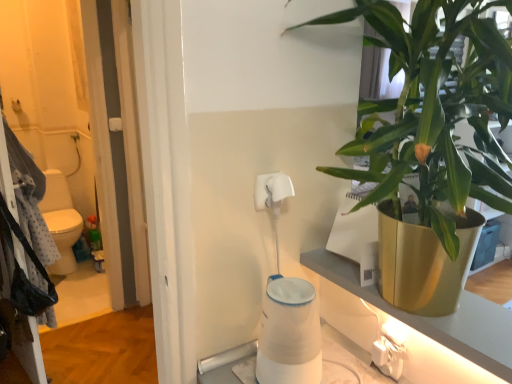
In order to face white plastic electric outlet at lower right, should I rotate leftwards or rightwards?

You should rotate right by 17.111 degrees.

This screenshot has height=384, width=512. Find the location of `white plastic electric outlet at lower right`. white plastic electric outlet at lower right is located at coordinates (390, 350).

Considering the relative positions of spotted fabric laundry at left and white matte toilet paper at upper center, which ranks as the 1th toilet paper in top-to-bottom order, in the image provided, is spotted fabric laundry at left to the left of white matte toilet paper at upper center, which ranks as the 1th toilet paper in top-to-bottom order, from the viewer's perspective?

Indeed, spotted fabric laundry at left is positioned on the left side of white matte toilet paper at upper center, which ranks as the 1th toilet paper in top-to-bottom order.

Is spotted fabric laundry at left placed right next to white matte toilet paper at upper center, which ranks as the 1th toilet paper in top-to-bottom order?

They are not placed beside each other.

How much distance is there between spotted fabric laundry at left and white matte toilet paper at upper center, which is the second toilet paper in bottom-to-top order?

A distance of 4.72 feet exists between spotted fabric laundry at left and white matte toilet paper at upper center, which is the second toilet paper in bottom-to-top order.

Could you tell me if spotted fabric laundry at left is facing white matte toilet paper at upper center, which is the second toilet paper in bottom-to-top order?

No, spotted fabric laundry at left is not turned towards white matte toilet paper at upper center, which is the second toilet paper in bottom-to-top order.

Is spotted fabric laundry at left a part of white plastic electric outlet at lower right?

No, white plastic electric outlet at lower right does not contain spotted fabric laundry at left.

Between point (394, 360) and point (54, 327), which one is positioned in front?

The point (394, 360) is more forward.

Are white plastic electric outlet at lower right and spotted fabric laundry at left beside each other?

No, white plastic electric outlet at lower right is not beside spotted fabric laundry at left.

From the picture: Considering the sizes of white plastic electric outlet at lower right and spotted fabric laundry at left in the image, is white plastic electric outlet at lower right taller or shorter than spotted fabric laundry at left?

Considering their sizes, white plastic electric outlet at lower right has less height than spotted fabric laundry at left.

Which is in front, white matte toilet paper at center, arranged as the 1th toilet paper when ordered from the bottom, or white matte toilet paper at upper center, which ranks as the 1th toilet paper in top-to-bottom order?

white matte toilet paper at center, arranged as the 1th toilet paper when ordered from the bottom.

Does point (319, 355) appear closer or farther from the camera than point (259, 197)?

Clearly, point (319, 355) is closer to the camera than point (259, 197).

Would you say white matte toilet paper at center, arranged as the 1th toilet paper when ordered from the bottom, is outside white matte toilet paper at upper center, which ranks as the 1th toilet paper in top-to-bottom order?

Indeed, white matte toilet paper at center, arranged as the 1th toilet paper when ordered from the bottom, is completely outside white matte toilet paper at upper center, which ranks as the 1th toilet paper in top-to-bottom order.

Is white matte toilet paper at center, arranged as the 1th toilet paper when ordered from the bottom, oriented towards white matte toilet paper at upper center, which ranks as the 1th toilet paper in top-to-bottom order?

No, white matte toilet paper at center, arranged as the 1th toilet paper when ordered from the bottom, does not turn towards white matte toilet paper at upper center, which ranks as the 1th toilet paper in top-to-bottom order.

Considering the positions of points (265, 193) and (372, 351), is point (265, 193) closer to camera compared to point (372, 351)?

That is True.

Would you say white matte toilet paper at upper center, which is the second toilet paper in bottom-to-top order, is to the left or to the right of white plastic electric outlet at lower right in the picture?

Based on their positions, white matte toilet paper at upper center, which is the second toilet paper in bottom-to-top order, is located to the left of white plastic electric outlet at lower right.

Looking at their sizes, would you say white matte toilet paper at upper center, which ranks as the 1th toilet paper in top-to-bottom order, is wider or thinner than white plastic electric outlet at lower right?

white matte toilet paper at upper center, which ranks as the 1th toilet paper in top-to-bottom order, is thinner than white plastic electric outlet at lower right.

In the scene shown: From a real-world perspective, which object rests below the other?

From a 3D spatial view, white plastic electric outlet at lower right is below.

Which object is thinner, spotted fabric laundry at left or white matte toilet paper at center, arranged as the 1th toilet paper when ordered from the bottom?

spotted fabric laundry at left is thinner.

Could you tell me if spotted fabric laundry at left is turned towards white matte toilet paper at center, which ranks as the second toilet paper in top-to-bottom order?

No, spotted fabric laundry at left does not turn towards white matte toilet paper at center, which ranks as the second toilet paper in top-to-bottom order.

From the image's perspective, is spotted fabric laundry at left below white matte toilet paper at center, which ranks as the second toilet paper in top-to-bottom order?

No, from the image's perspective, spotted fabric laundry at left is not below white matte toilet paper at center, which ranks as the second toilet paper in top-to-bottom order.

Can we say spotted fabric laundry at left lies outside green leafy plant at upper right?

spotted fabric laundry at left lies outside green leafy plant at upper right's area.

Image resolution: width=512 pixels, height=384 pixels. Find the location of `houseplant positioned vertically above the spotted fabric laundry at left (from a real-world perspective)`. houseplant positioned vertically above the spotted fabric laundry at left (from a real-world perspective) is located at coordinates (431, 137).

Is spotted fabric laundry at left facing towards green leafy plant at upper right?

No, spotted fabric laundry at left is not turned towards green leafy plant at upper right.

Consider the image. Between spotted fabric laundry at left and green leafy plant at upper right, which one has smaller size?

Smaller between the two is spotted fabric laundry at left.

Is point (398, 375) farther from viewer compared to point (389, 225)?

Yes, point (398, 375) is behind point (389, 225).

Is white plastic electric outlet at lower right surrounding green leafy plant at upper right?

Definitely not — green leafy plant at upper right is not inside white plastic electric outlet at lower right.

Image resolution: width=512 pixels, height=384 pixels. Find the location of `toilet paper that appears above the spotted fabric laundry at left (from the image's perspective)`. toilet paper that appears above the spotted fabric laundry at left (from the image's perspective) is located at coordinates (272, 190).

At what (x,y) coordinates should I click in order to perform the action: click on laundry below the white plastic electric outlet at lower right (from a real-world perspective). Please return your answer as a coordinate pair (x, y). The width and height of the screenshot is (512, 384). Looking at the image, I should click on (30, 198).

Based on their spatial positions, is green leafy plant at upper right or white matte toilet paper at upper center, which is the second toilet paper in bottom-to-top order, closer to white matte toilet paper at center, arranged as the 1th toilet paper when ordered from the bottom?

Among the two, white matte toilet paper at upper center, which is the second toilet paper in bottom-to-top order, is located nearer to white matte toilet paper at center, arranged as the 1th toilet paper when ordered from the bottom.

Based on their spatial positions, is white matte toilet paper at center, arranged as the 1th toilet paper when ordered from the bottom, or white plastic electric outlet at lower right further from green leafy plant at upper right?

white plastic electric outlet at lower right lies further to green leafy plant at upper right than the other object.

Based on their spatial positions, is white matte toilet paper at upper center, which is the second toilet paper in bottom-to-top order, or white plastic electric outlet at lower right further from green leafy plant at upper right?

white plastic electric outlet at lower right.

Looking at this image, looking at the image, which one is located further to green leafy plant at upper right, white matte toilet paper at upper center, which is the second toilet paper in bottom-to-top order, or white matte toilet paper at center, arranged as the 1th toilet paper when ordered from the bottom?

Based on the image, white matte toilet paper at center, arranged as the 1th toilet paper when ordered from the bottom, appears to be further to green leafy plant at upper right.

Looking at the image, which one is located closer to spotted fabric laundry at left, white plastic electric outlet at lower right or green leafy plant at upper right?

green leafy plant at upper right lies closer to spotted fabric laundry at left than the other object.

When comparing their distances from white matte toilet paper at center, arranged as the 1th toilet paper when ordered from the bottom, does green leafy plant at upper right or spotted fabric laundry at left seem closer?

The object closer to white matte toilet paper at center, arranged as the 1th toilet paper when ordered from the bottom, is green leafy plant at upper right.

When comparing their distances from white plastic electric outlet at lower right, does white matte toilet paper at upper center, which is the second toilet paper in bottom-to-top order, or white matte toilet paper at center, arranged as the 1th toilet paper when ordered from the bottom, seem further?

white matte toilet paper at upper center, which is the second toilet paper in bottom-to-top order, is further to white plastic electric outlet at lower right.

From the image, which object appears to be nearer to white matte toilet paper at center, arranged as the 1th toilet paper when ordered from the bottom, white matte toilet paper at upper center, which ranks as the 1th toilet paper in top-to-bottom order, or green leafy plant at upper right?

white matte toilet paper at upper center, which ranks as the 1th toilet paper in top-to-bottom order, lies closer to white matte toilet paper at center, arranged as the 1th toilet paper when ordered from the bottom, than the other object.

You are a GUI agent. You are given a task and a screenshot of the screen. Output one action in this format:
    pyautogui.click(x=<x>, y=<y>)
    Task: Click on the electric outlet between spotted fabric laundry at left and green leafy plant at upper right in the horizontal direction
    The image size is (512, 384).
    Given the screenshot: What is the action you would take?
    pyautogui.click(x=390, y=350)

Where is `toilet paper between green leafy plant at upper right and white plastic electric outlet at lower right along the z-axis`? toilet paper between green leafy plant at upper right and white plastic electric outlet at lower right along the z-axis is located at coordinates (289, 334).

Locate an element on the screen. Image resolution: width=512 pixels, height=384 pixels. toilet paper between spotted fabric laundry at left and white matte toilet paper at center, arranged as the 1th toilet paper when ordered from the bottom, from left to right is located at coordinates (272, 190).

You are a GUI agent. You are given a task and a screenshot of the screen. Output one action in this format:
    pyautogui.click(x=<x>, y=<y>)
    Task: Click on the electric outlet between green leafy plant at upper right and white matte toilet paper at upper center, which is the second toilet paper in bottom-to-top order, in the front-back direction
    Image resolution: width=512 pixels, height=384 pixels.
    Given the screenshot: What is the action you would take?
    pyautogui.click(x=390, y=350)